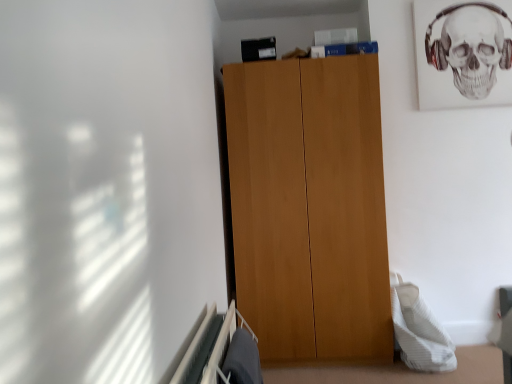
Locate an element on the screen. This screenshot has width=512, height=384. black matte skull at upper right is located at coordinates (473, 47).

Image resolution: width=512 pixels, height=384 pixels. Describe the element at coordinates (473, 47) in the screenshot. I see `black matte skull at upper right` at that location.

Where is `black matte skull at upper right`? Image resolution: width=512 pixels, height=384 pixels. black matte skull at upper right is located at coordinates (473, 47).